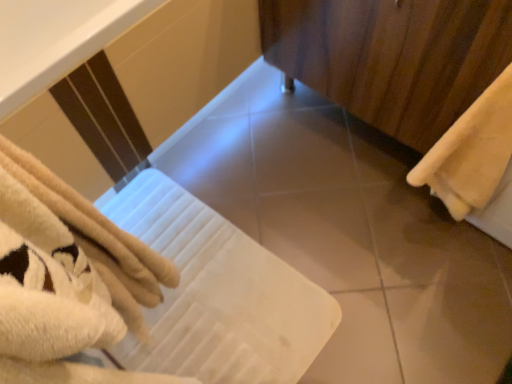
Question: Does wooden curtain at right have a greater width compared to smooth beige tile at center?

Choices:
 (A) yes
 (B) no

Answer: (A)

Question: Is wooden curtain at right not within smooth beige tile at center?

Choices:
 (A) yes
 (B) no

Answer: (A)

Question: Is wooden curtain at right with smooth beige tile at center?

Choices:
 (A) yes
 (B) no

Answer: (B)

Question: Is wooden curtain at right looking in the opposite direction of smooth beige tile at center?

Choices:
 (A) no
 (B) yes

Answer: (A)

Question: From a real-world perspective, is wooden curtain at right beneath smooth beige tile at center?

Choices:
 (A) yes
 (B) no

Answer: (B)

Question: From the image's perspective, is wooden curtain at right above or below smooth beige tile at center?

Choices:
 (A) below
 (B) above

Answer: (B)

Question: Is wooden curtain at right bigger or smaller than smooth beige tile at center?

Choices:
 (A) small
 (B) big

Answer: (B)

Question: From a real-world perspective, is wooden curtain at right above or below smooth beige tile at center?

Choices:
 (A) above
 (B) below

Answer: (A)

Question: Is wooden curtain at right to the left or to the right of smooth beige tile at center in the image?

Choices:
 (A) right
 (B) left

Answer: (A)

Question: Is smooth beige tile at center inside the boundaries of beige soft towel at right, or outside?

Choices:
 (A) outside
 (B) inside

Answer: (A)

Question: Looking at their shapes, would you say smooth beige tile at center is wider or thinner than beige soft towel at right?

Choices:
 (A) wide
 (B) thin

Answer: (A)

Question: Considering the positions of smooth beige tile at center and beige soft towel at right in the image, is smooth beige tile at center bigger or smaller than beige soft towel at right?

Choices:
 (A) small
 (B) big

Answer: (A)

Question: From the image's perspective, relative to beige soft towel at right, is smooth beige tile at center above or below?

Choices:
 (A) above
 (B) below

Answer: (B)

Question: Is point (x=452, y=129) closer or farther from the camera than point (x=159, y=369)?

Choices:
 (A) closer
 (B) farther

Answer: (A)

Question: Is beige soft towel at right bigger or smaller than white soft towel at center?

Choices:
 (A) small
 (B) big

Answer: (B)